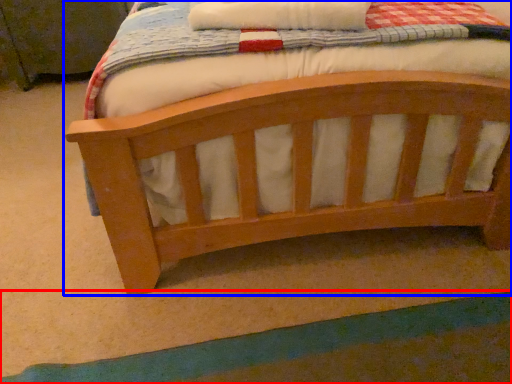
Question: Which of the following is the closest to the observer, strip (highlighted by a red box) or bed (highlighted by a blue box)?

Choices:
 (A) strip
 (B) bed

Answer: (B)